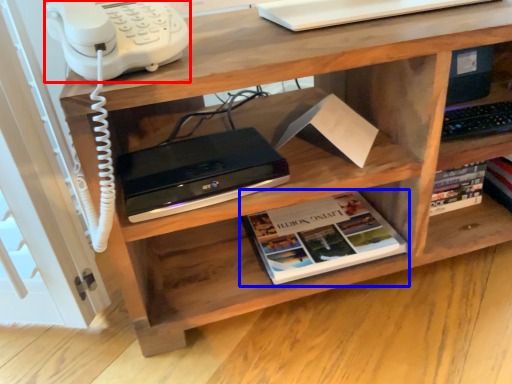
Question: Which object appears farthest to the camera in this image, corded phone (highlighted by a red box) or book (highlighted by a blue box)?

Choices:
 (A) corded phone
 (B) book

Answer: (B)